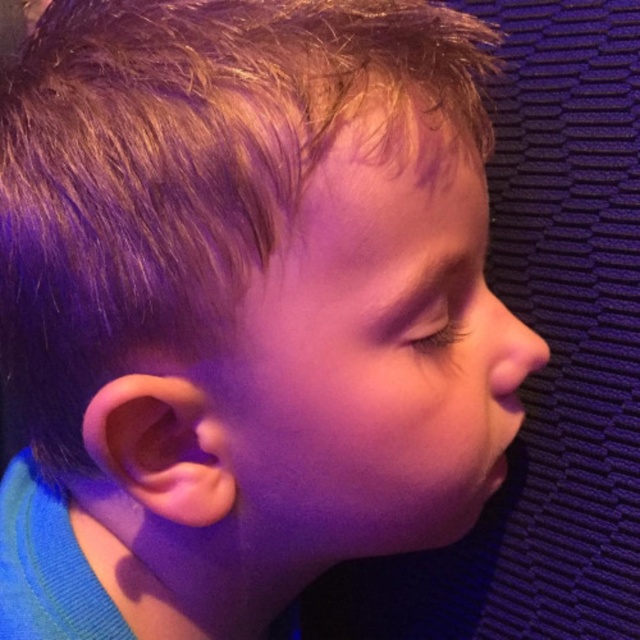
Question: Estimate the real-world distances between objects in this image. Which object is farther from the smooth flesh nose at right?

Choices:
 (A) smooth skin face at center
 (B) blonde smooth hair at upper left

Answer: (B)

Question: Considering the real-world distances, which object is farthest from the smooth skin face at center?

Choices:
 (A) blonde smooth hair at upper left
 (B) smooth flesh nose at right

Answer: (B)

Question: Does blonde smooth hair at upper left have a lesser width compared to smooth flesh nose at right?

Choices:
 (A) no
 (B) yes

Answer: (A)

Question: Does smooth skin face at center appear under smooth flesh nose at right?

Choices:
 (A) yes
 (B) no

Answer: (A)

Question: Which point is farther to the camera?

Choices:
 (A) smooth flesh nose at right
 (B) smooth skin face at center
 (C) blonde smooth hair at upper left

Answer: (A)

Question: Is smooth skin face at center closer to the viewer compared to smooth flesh nose at right?

Choices:
 (A) no
 (B) yes

Answer: (B)